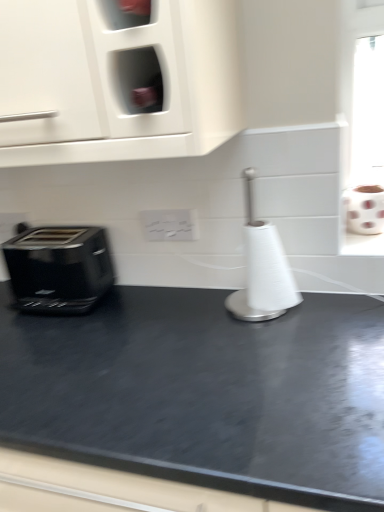
What is the approximate width of black glossy toaster at left?

black glossy toaster at left is 20.13 centimeters wide.

Where is `white glossy electric outlet at center`? This screenshot has height=512, width=384. white glossy electric outlet at center is located at coordinates (169, 225).

From the image's perspective, is black glossy toaster at left located above white matte toilet paper at right?

No.

Is black glossy toaster at left outside of white matte toilet paper at right?

Yes, black glossy toaster at left is not within white matte toilet paper at right.

Considering the relative sizes of black glossy toaster at left and white matte toilet paper at right in the image provided, is black glossy toaster at left shorter than white matte toilet paper at right?

Incorrect, the height of black glossy toaster at left does not fall short of that of white matte toilet paper at right.

In the scene shown: How many degrees apart are the facing directions of black glossy toaster at left and white matte toilet paper at right?

black glossy toaster at left and white matte toilet paper at right are facing 1.06 degrees away from each other.

Is point (252, 228) positioned in front of point (37, 281)?

Yes.

From the picture: How distant is white paper towel holder at center from black glossy toaster at left?

48.11 centimeters.

Who is taller, white paper towel holder at center or black glossy toaster at left?

With more height is white paper towel holder at center.

From a real-world perspective, is white paper towel holder at center physically located above or below black glossy toaster at left?

white paper towel holder at center is situated higher than black glossy toaster at left in the real world.

Is white glossy electric outlet at center wider or thinner than white matte toilet paper at right?

Clearly, white glossy electric outlet at center has less width compared to white matte toilet paper at right.

Looking at this image, is white glossy electric outlet at center surrounding white matte toilet paper at right?

No, white matte toilet paper at right is not surrounded by white glossy electric outlet at center.

In the image, there is a white glossy electric outlet at center. Where is `toilet paper below it (from a real-world perspective)`? This screenshot has height=512, width=384. toilet paper below it (from a real-world perspective) is located at coordinates (365, 209).

Is point (170, 225) positioned after point (367, 216)?

Yes, it is behind point (367, 216).

Considering the relative positions of black glossy toaster at left and white paper towel holder at center in the image provided, is black glossy toaster at left behind white paper towel holder at center?

Yes, the depth of black glossy toaster at left is greater than that of white paper towel holder at center.

From a real-world perspective, is black glossy toaster at left positioned over white paper towel holder at center based on gravity?

No, from a real-world perspective, black glossy toaster at left is not above white paper towel holder at center.

How different are the orientations of black glossy toaster at left and white paper towel holder at center in degrees?

0.65 degrees.

Looking at this image, is white matte toilet paper at right at the back of white paper towel holder at center?

No.

Is white paper towel holder at center far from white matte toilet paper at right?

white paper towel holder at center is near white matte toilet paper at right, not far away.

Where is `appliance in front of the white matte toilet paper at right`? appliance in front of the white matte toilet paper at right is located at coordinates (262, 269).

Between white paper towel holder at center and white matte toilet paper at right, which one has less height?

Standing shorter between the two is white matte toilet paper at right.

From a real-world perspective, between white paper towel holder at center and white glossy electric outlet at center, who is vertically higher?

In real-world perspective, white glossy electric outlet at center is above.

Is white paper towel holder at center directly adjacent to white glossy electric outlet at center?

No.

Is point (245, 310) less distant than point (179, 232)?

Yes, point (245, 310) is in front of point (179, 232).

Does white paper towel holder at center have a greater width compared to white glossy electric outlet at center?

Yes.

From the image's perspective, which one is positioned lower, white matte toilet paper at right or white paper towel holder at center?

white paper towel holder at center, from the image's perspective.

Is white matte toilet paper at right inside or outside of white paper towel holder at center?

white matte toilet paper at right exists outside the volume of white paper towel holder at center.

Is white matte toilet paper at right closer to camera compared to white paper towel holder at center?

No, it is not.

Looking at their sizes, would you say white matte toilet paper at right is wider or thinner than white paper towel holder at center?

white matte toilet paper at right is thinner than white paper towel holder at center.

This screenshot has height=512, width=384. I want to click on toilet paper located above the black glossy toaster at left (from a real-world perspective), so click(x=365, y=209).

Identify the location of toaster on the left of the white paper towel holder at center. (59, 268).

Based on their spatial positions, is white glossy electric outlet at center or black glossy toaster at left closer to white matte toilet paper at right?

white glossy electric outlet at center is positioned closer to the anchor white matte toilet paper at right.

When comparing their distances from white matte toilet paper at right, does white paper towel holder at center or white glossy electric outlet at center seem further?

white glossy electric outlet at center lies further to white matte toilet paper at right than the other object.

From the picture: Looking at the image, which one is located closer to white glossy electric outlet at center, black glossy toaster at left or white matte toilet paper at right?

The object closer to white glossy electric outlet at center is black glossy toaster at left.

Based on their spatial positions, is white paper towel holder at center or white matte toilet paper at right further from white glossy electric outlet at center?

white matte toilet paper at right is positioned further to the anchor white glossy electric outlet at center.

Which object lies further to the anchor point white paper towel holder at center, white glossy electric outlet at center or white matte toilet paper at right?

white matte toilet paper at right is further to white paper towel holder at center.

Which object lies further to the anchor point black glossy toaster at left, white paper towel holder at center or white glossy electric outlet at center?

white paper towel holder at center is positioned further to the anchor black glossy toaster at left.

From the image, which object appears to be farther from black glossy toaster at left, white paper towel holder at center or white matte toilet paper at right?

Based on the image, white matte toilet paper at right appears to be further to black glossy toaster at left.

When comparing their distances from white glossy electric outlet at center, does white matte toilet paper at right or white paper towel holder at center seem closer?

white paper towel holder at center lies closer to white glossy electric outlet at center than the other object.

Locate an element on the screen. Image resolution: width=384 pixels, height=512 pixels. appliance between white glossy electric outlet at center and white matte toilet paper at right is located at coordinates (262, 269).

Locate an element on the screen. The image size is (384, 512). electric outlet situated between black glossy toaster at left and white paper towel holder at center from left to right is located at coordinates (169, 225).

In order to click on electric outlet situated between black glossy toaster at left and white matte toilet paper at right from left to right in this screenshot , I will do `click(169, 225)`.

I want to click on appliance between black glossy toaster at left and white matte toilet paper at right, so click(262, 269).